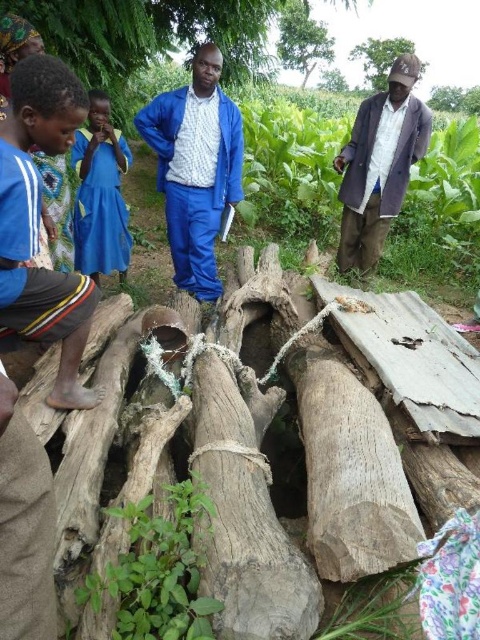
Does point (106, 244) come in front of point (370, 76)?

Yes, it is.

Between blue fabric dress at center and brown rough tree trunk at upper right, which one is positioned higher?

brown rough tree trunk at upper right

You are a GUI agent. You are given a task and a screenshot of the screen. Output one action in this format:
    pyautogui.click(x=<x>, y=<y>)
    Task: Click on the blue fabric dress at center
    
    Given the screenshot: What is the action you would take?
    pyautogui.click(x=100, y=195)

Find the location of a particular element. Image resolution: width=480 pixels, height=640 pixels. blue fabric dress at center is located at coordinates (100, 195).

Between gray rough tree trunk at center and blue fabric suit at center, which one is positioned lower?

Positioned lower is gray rough tree trunk at center.

From the picture: Which of these two, gray rough tree trunk at center or blue fabric suit at center, stands shorter?

Standing shorter between the two is gray rough tree trunk at center.

Which is behind, point (250, 468) or point (186, 131)?

Point (186, 131)

Locate an element on the screen. This screenshot has width=480, height=640. gray rough tree trunk at center is located at coordinates (243, 520).

Based on the photo, between dark gray fabric coat at right and blue fabric dress at center, which one appears on the left side from the viewer's perspective?

blue fabric dress at center

Looking at this image, which is above, dark gray fabric coat at right or blue fabric dress at center?

dark gray fabric coat at right

Does point (365, 218) come behind point (88, 209)?

That is True.

Locate an element on the screen. The image size is (480, 640). dark gray fabric coat at right is located at coordinates pyautogui.click(x=380, y=164).